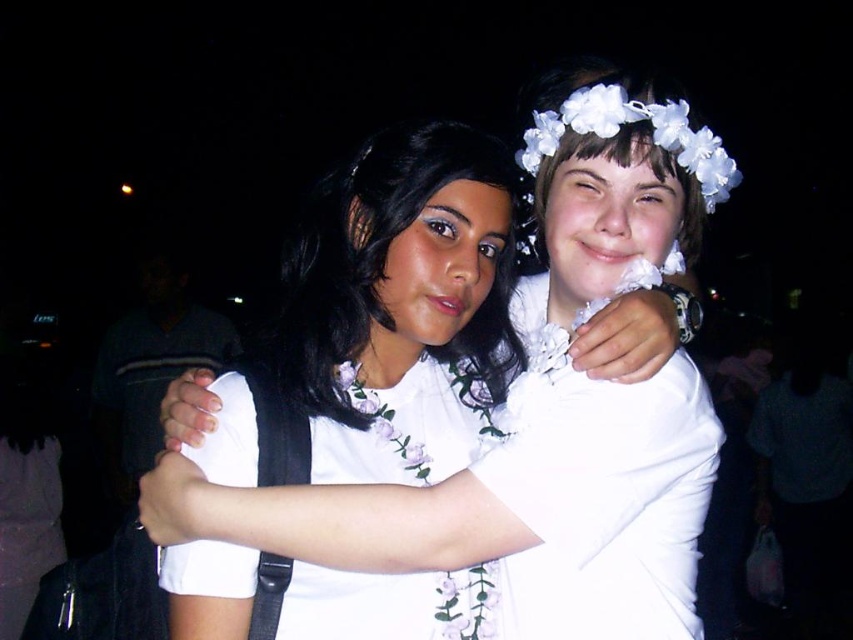
You are a photographer who wants to adjust the lighting to highlight the white matte floral crown at upper center in the image. Since the background is dark and out of focus, can you determine if the point marked by coordinates point [541,413] is located on the person on the left or the person on the right?

The point [541,413] marks the white matte floral crown at upper center, which is on the person on the right since they have a white flower crown as described in the scene.

You are a photographer reviewing a group photo taken at night. You notice two white floral crowns in the image. Which one is nearer to you, the white matte floral crown at upper center or the white floral crown at upper right?

The white matte floral crown at upper center is closer to the viewer than the white floral crown at upper right.

You are a photographer who wants to adjust the lighting so that the white floral fabric dress at center and the white floral crown at upper right are both well lit. Since the dress is to the left of the crown, which direction should you move the light source to ensure both are evenly illuminated?

The white floral fabric dress at center is to the left of the white floral crown at upper right. To evenly illuminate both, move the light source to the right side so that it can cover both objects simultaneously.